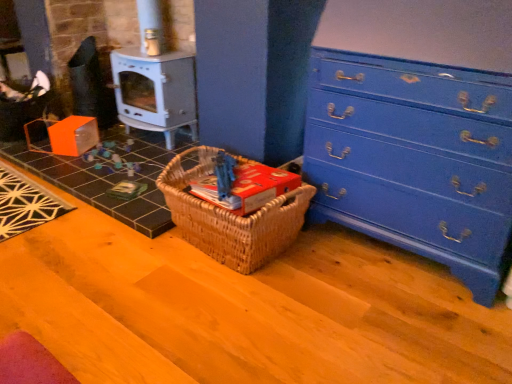
The width and height of the screenshot is (512, 384). Find the location of `vacant area that lies in front of blue painted wood chest of drawers at right`. vacant area that lies in front of blue painted wood chest of drawers at right is located at coordinates 395,318.